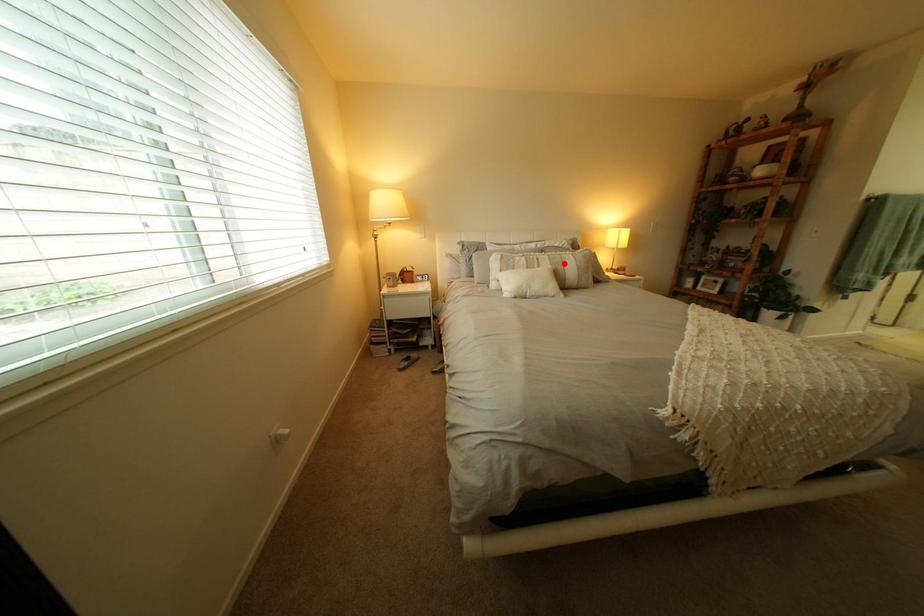
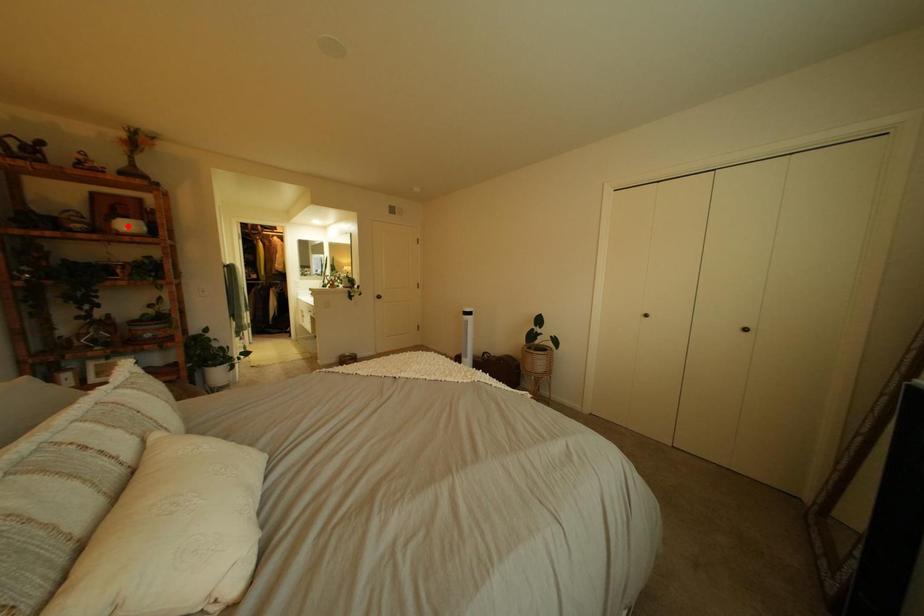
I am providing you with two images of the same scene from different viewpoints. A red point is marked on the first image and another point is marked on the second image. Does the point marked in image1 correspond to the same location as the one in image2?

No